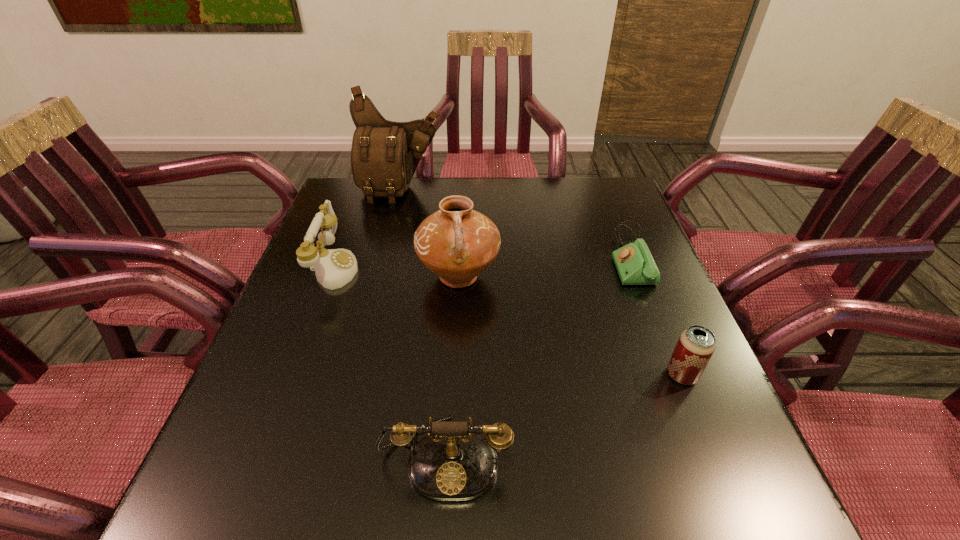
In order to click on telephone positioned at the left edge in this screenshot , I will do `click(334, 268)`.

Where is `beer can that is at the right edge`? The width and height of the screenshot is (960, 540). beer can that is at the right edge is located at coordinates (696, 345).

Identify the location of telephone that is at the right edge. This screenshot has height=540, width=960. (635, 265).

Locate an element on the screen. object that is at the far left corner is located at coordinates (384, 156).

The image size is (960, 540). In the image, there is a desktop. Identify the location of vacant space at the far edge. (493, 202).

What are the coordinates of `free region at the near edge` in the screenshot? It's located at (461, 510).

Locate an element on the screen. The width and height of the screenshot is (960, 540). vacant space at the right edge of the desktop is located at coordinates (630, 293).

Image resolution: width=960 pixels, height=540 pixels. Identify the location of vacant space at the far left corner of the desktop. (337, 185).

Find the location of a particular element. vacant space at the far right corner is located at coordinates (586, 189).

In order to click on vacant position at the near right corner of the desktop in this screenshot , I will do `click(668, 516)`.